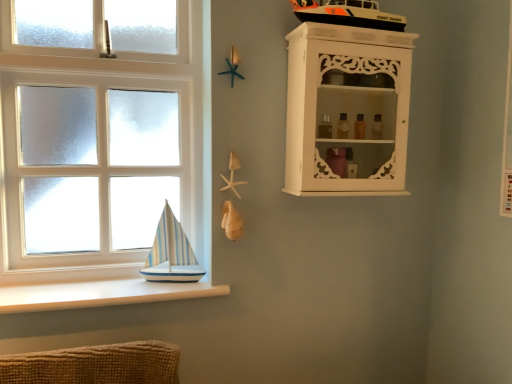
Question: In terms of size, does white carved cabinet at upper right appear bigger or smaller than white wooden window at left?

Choices:
 (A) big
 (B) small

Answer: (B)

Question: From the image's perspective, is white carved cabinet at upper right located above or below white wooden window at left?

Choices:
 (A) below
 (B) above

Answer: (B)

Question: Which of these objects is positioned closest to the white wooden window at left?

Choices:
 (A) striped sailboat at window sill
 (B) white smooth ledge at lower left
 (C) white carved cabinet at upper right

Answer: (A)

Question: Estimate the real-world distances between objects in this image. Which object is farther from the striped sailboat at window sill?

Choices:
 (A) white carved cabinet at upper right
 (B) white wooden window at left
 (C) white smooth ledge at lower left

Answer: (A)